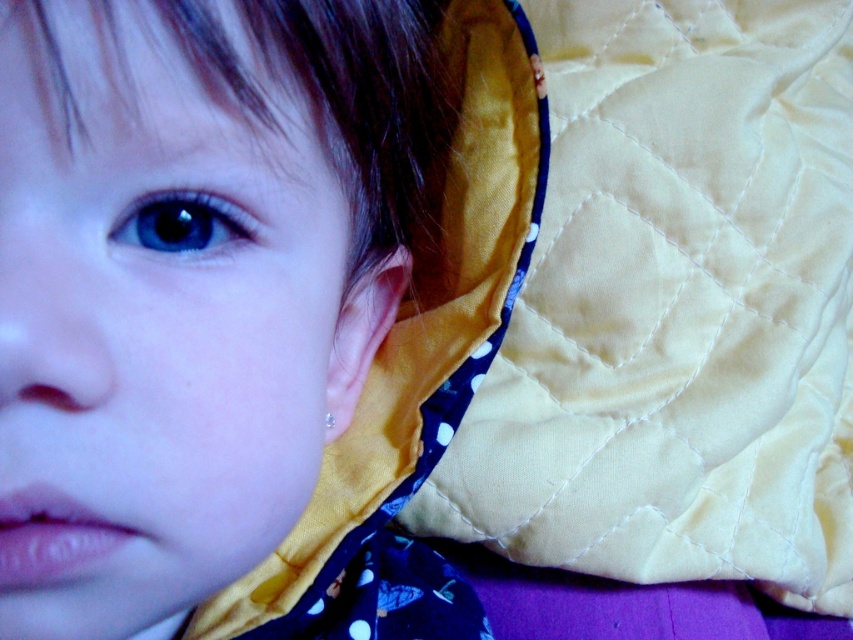
Which is behind, point (445, 481) or point (157, 243)?

The point (445, 481) is more distant.

I want to click on yellow quilted fabric at upper right, so click(677, 308).

Is point (305, 221) closer to viewer compared to point (138, 202)?

No, (305, 221) is behind (138, 202).

You are a GUI agent. You are given a task and a screenshot of the screen. Output one action in this format:
    pyautogui.click(x=<x>, y=<y>)
    Task: Click on the matte yellow fabric at upper left
    This screenshot has height=640, width=853.
    Given the screenshot: What is the action you would take?
    pyautogui.click(x=160, y=324)

Is yellow quilted fabric at upper right above matte yellow fabric at upper left?

Indeed, yellow quilted fabric at upper right is positioned over matte yellow fabric at upper left.

Who is positioned more to the right, yellow quilted fabric at upper right or matte yellow fabric at upper left?

From the viewer's perspective, yellow quilted fabric at upper right appears more on the right side.

You are a GUI agent. You are given a task and a screenshot of the screen. Output one action in this format:
    pyautogui.click(x=<x>, y=<y>)
    Task: Click on the yellow quilted fabric at upper right
    The image size is (853, 640).
    Given the screenshot: What is the action you would take?
    pyautogui.click(x=677, y=308)

At what (x,y) coordinates should I click in order to perform the action: click on yellow quilted fabric at upper right. Please return your answer as a coordinate pair (x, y). Looking at the image, I should click on (677, 308).